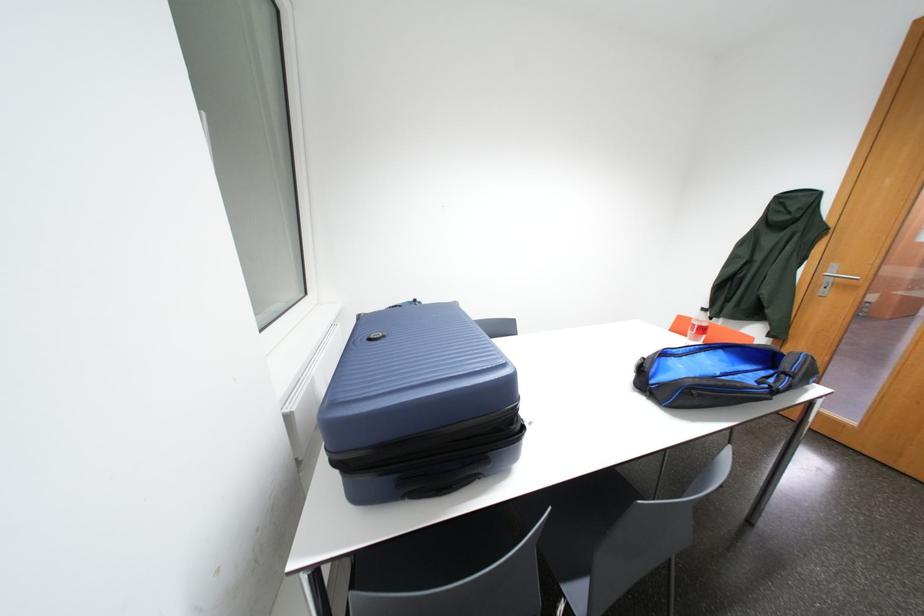
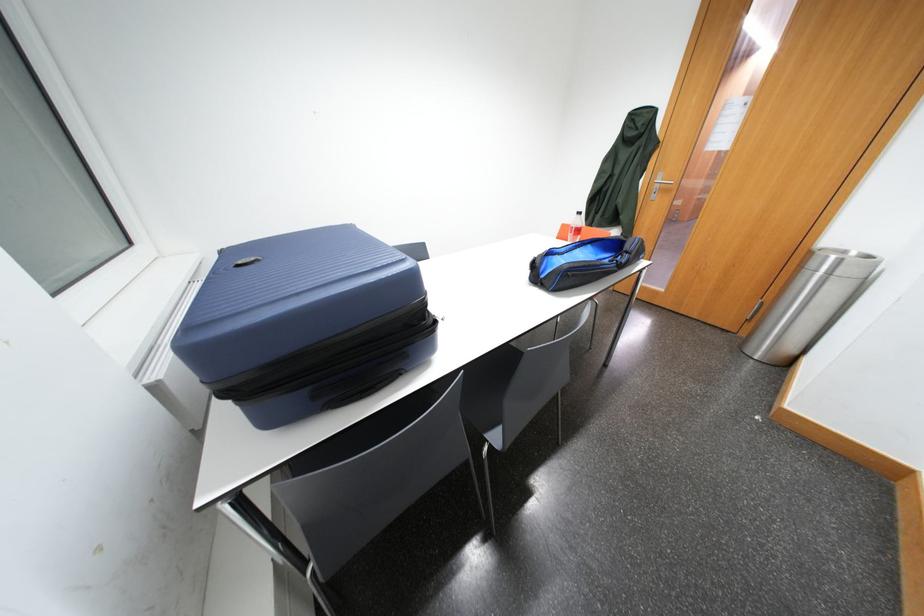
Question: Based on the continuous images, in which direction is the camera rotating? Reply with the corresponding letter.

Choices:
 (A) Left
 (B) Right
 (C) Up
 (D) Down

Answer: (B)